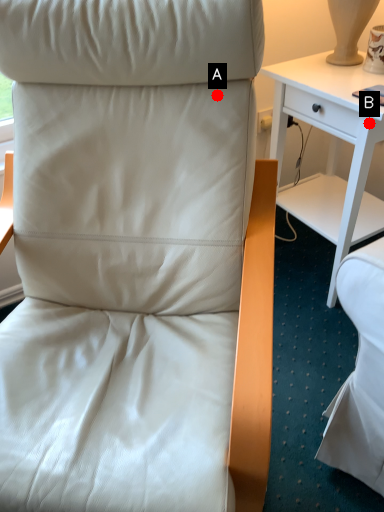
Question: Two points are circled on the image, labeled by A and B beside each circle. Among these points, which one is farthest from the camera?

Choices:
 (A) A is further
 (B) B is further

Answer: (B)